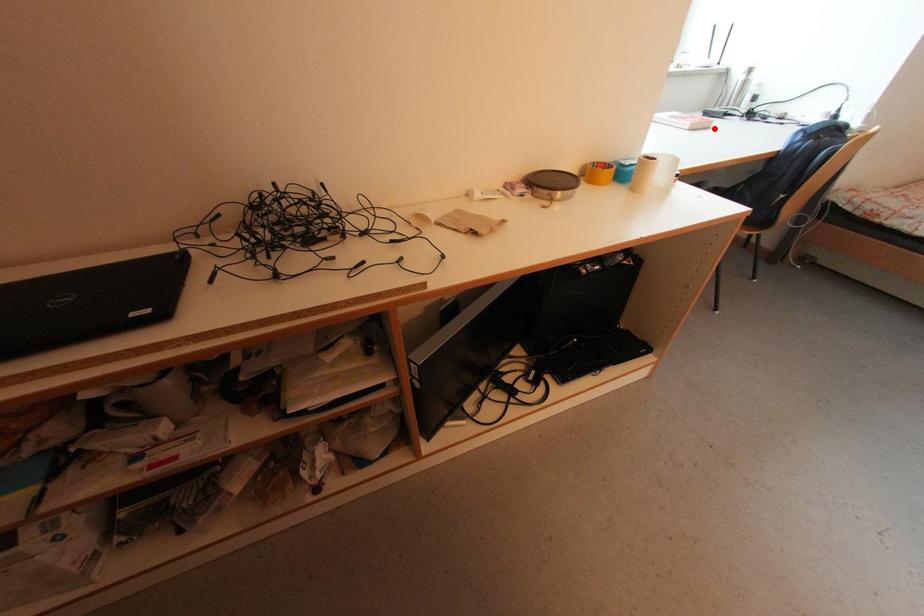
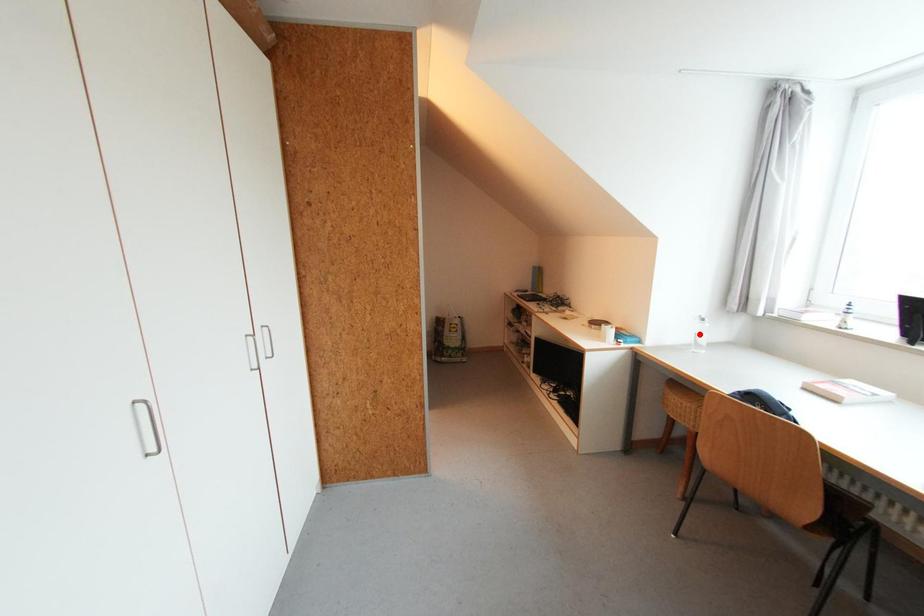
I am providing you with two images of the same scene from different viewpoints. A red point is marked on the first image and another point is marked on the second image. Do the highlighted points in image1 and image2 indicate the same real-world spot?

No